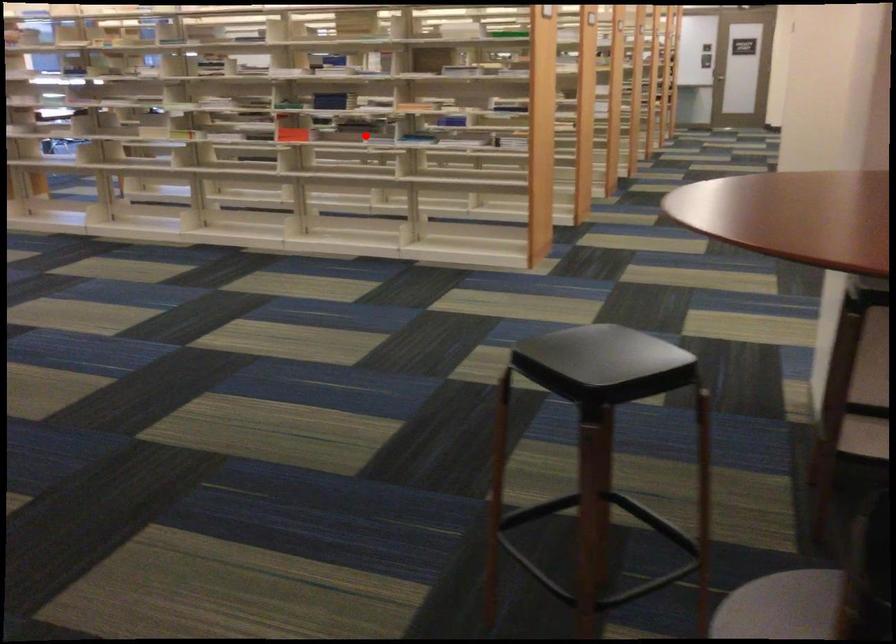
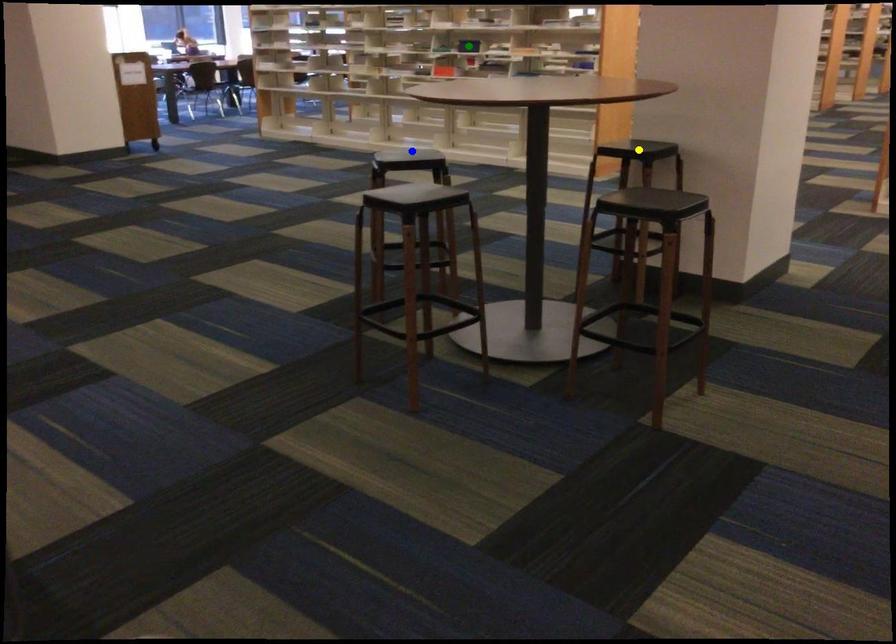
Question: I am providing you with two images of the same scene from different viewpoints. A red point is marked on the first image. You are given multiple points on the second image. Which spot in image 2 lines up with the point in image 1?

Choices:
 (A) yellow point
 (B) blue point
 (C) green point

Answer: (C)